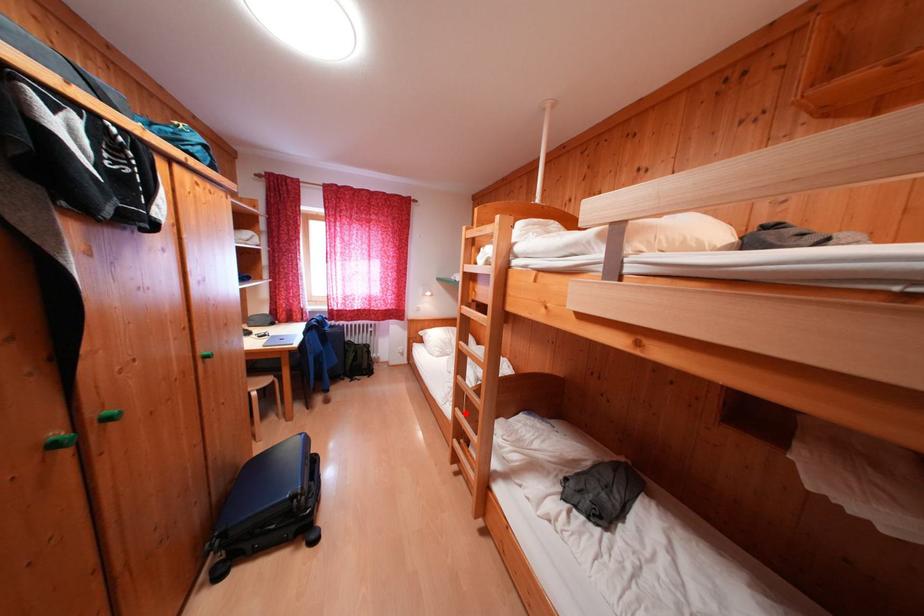
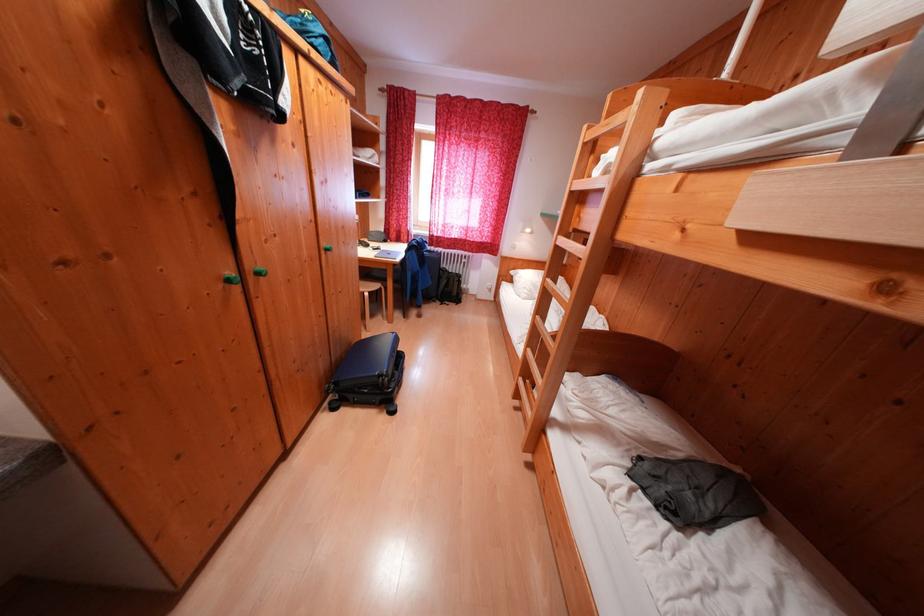
Question: I am providing you with two images of the same scene from different viewpoints. A red point is shown in image1. For the corresponding object point in image2, is it positioned nearer or farther from the camera?

Choices:
 (A) Nearer
 (B) Farther

Answer: (A)